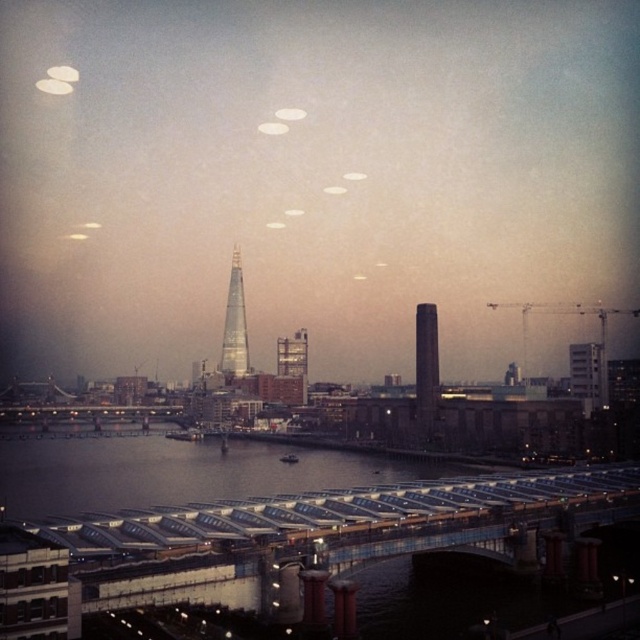
Between point (230, 372) and point (576, 381), which one is positioned behind?

The point (230, 372) is more distant.

Based on the photo, which is more to the right, shiny glass skyscraper at center or white concrete tower at right?

white concrete tower at right is more to the right.

Find the location of a particular element. The width and height of the screenshot is (640, 640). shiny glass skyscraper at center is located at coordinates (234, 323).

Does smooth glass tower at center have a lesser width compared to white concrete tower at right?

No.

Find the location of a particular element. smooth glass tower at center is located at coordinates (426, 368).

Who is positioned more to the left, smooth glass tower at center or shiny glass skyscraper at center?

shiny glass skyscraper at center

Between smooth glass tower at center and shiny glass skyscraper at center, which one is positioned lower?

smooth glass tower at center is below.

Between point (420, 310) and point (240, 328), which one is positioned behind?

The point (240, 328) is behind.

Find the location of `smooth glass tower at center`. smooth glass tower at center is located at coordinates (426, 368).